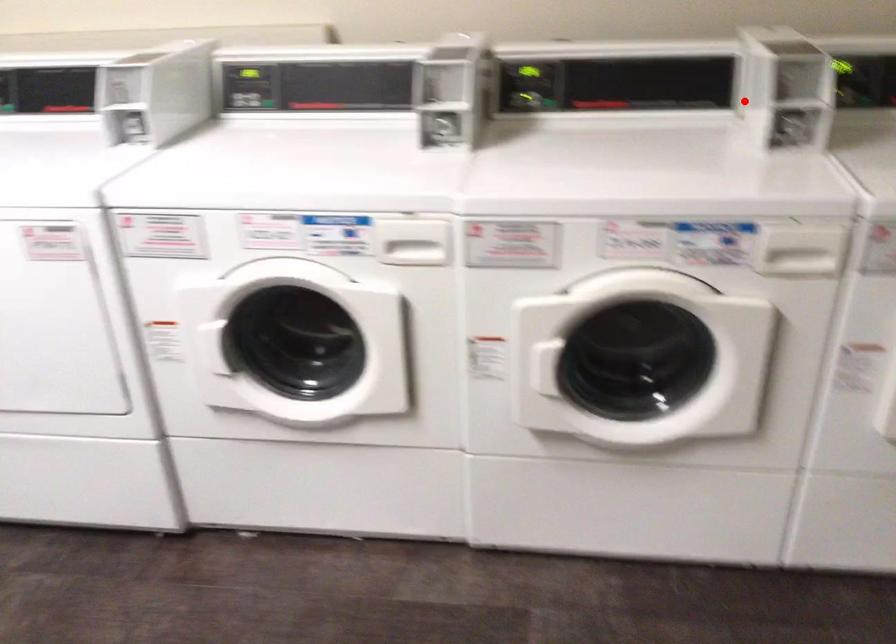
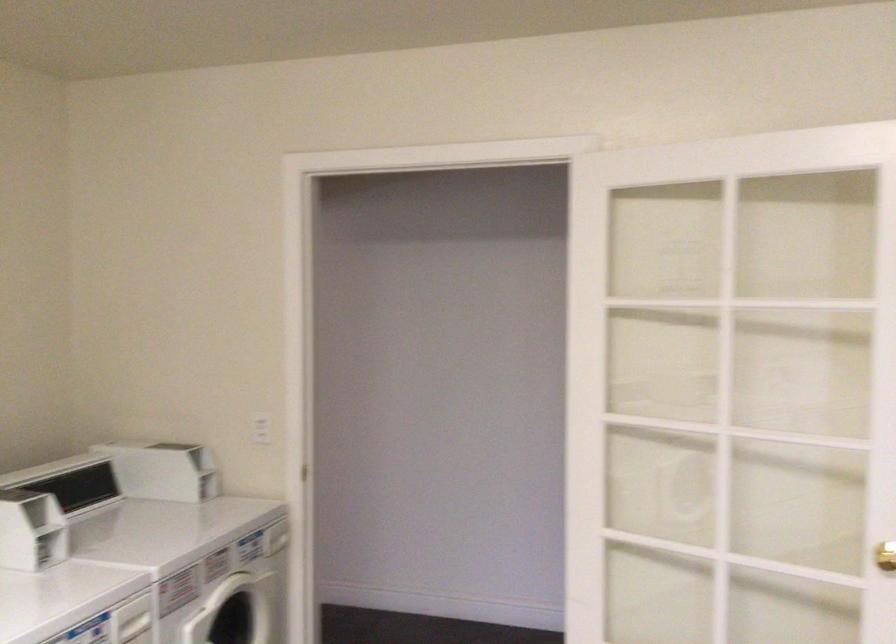
Locate, in the second image, the point that corresponds to the highlighted location in the first image.

(30, 529)